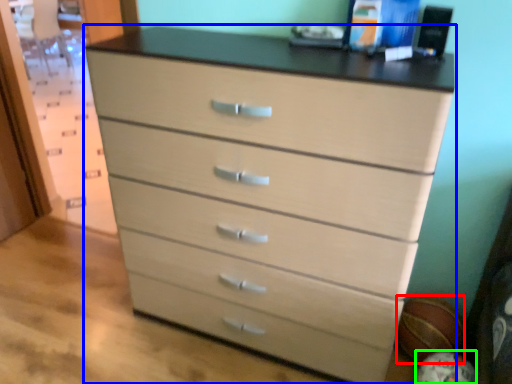
Question: Which is nearer to the basketball (highlighted by a red box)? chest of drawers (highlighted by a blue box) or basketball (highlighted by a green box).

Choices:
 (A) chest of drawers
 (B) basketball

Answer: (B)